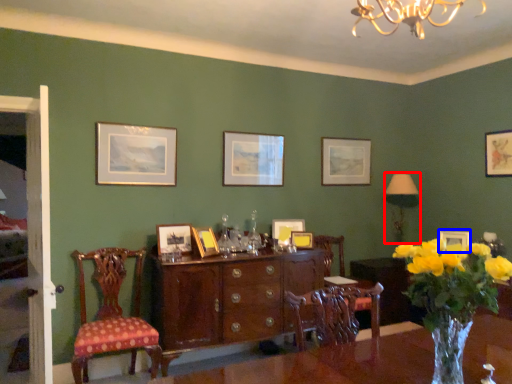
Question: Which of the following is the farthest to the observer, lamp (highlighted by a red box) or picture frame (highlighted by a blue box)?

Choices:
 (A) lamp
 (B) picture frame

Answer: (A)